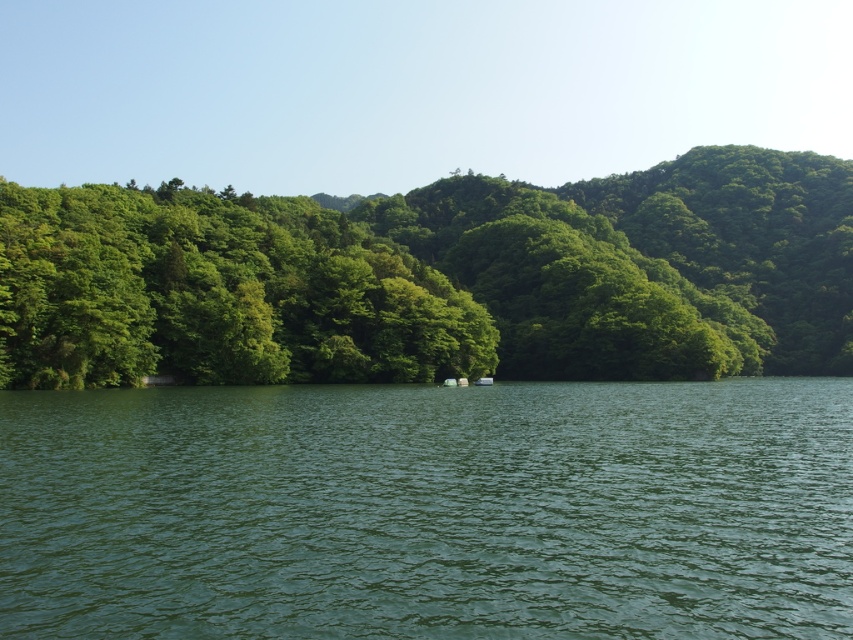
You are standing at the edge of the forest in this landscape and want to cross to the other side. The green liquid water at center and the green leafy trees at left are in your path. Which object is closer to you, and can you walk around it?

The green liquid water at center is positioned under the green leafy trees at left, meaning the trees are closer to you. Since the water is under the trees, you would need to walk around the trees first before reaching the water. However, the question mentions wanting to cross to the other side, so you might need to navigate around both obstacles as they are in your path.